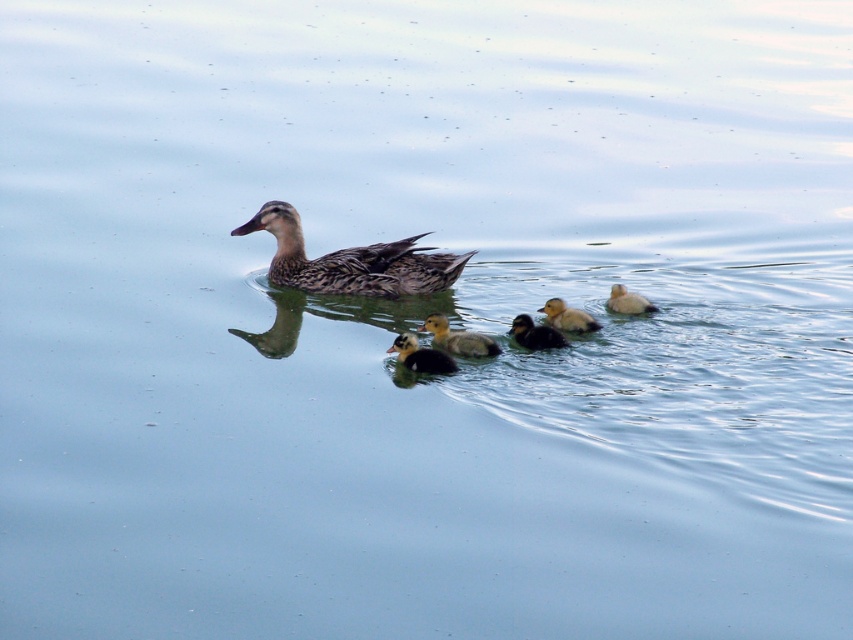
Between point (447, 348) and point (515, 323), which one is positioned in front?

Point (447, 348)

Is point (463, 349) behind point (518, 337)?

No, it is in front of (518, 337).

What are the coordinates of `brown fuzzy duckling at center` in the screenshot? It's located at (457, 339).

Is point (343, 291) behind point (444, 368)?

That is True.

Is brown speckled duckling at center further to the viewer compared to black fuzzy duckling at center?

Yes, brown speckled duckling at center is further from the viewer.

Who is more distant from viewer, (415, 276) or (418, 360)?

Positioned behind is point (415, 276).

At what (x,y) coordinates should I click in order to perform the action: click on brown speckled duckling at center. Please return your answer as a coordinate pair (x, y). This screenshot has width=853, height=640. Looking at the image, I should click on (351, 260).

Who is more distant from viewer, (570, 314) or (624, 307)?

The point (624, 307) is behind.

This screenshot has width=853, height=640. I want to click on yellow downy duckling at center, so click(x=567, y=317).